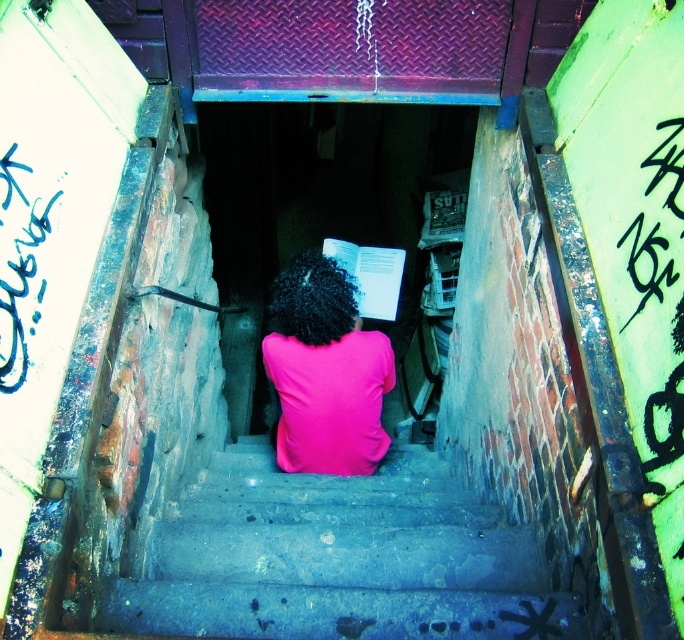
You are standing at the entrance of the alleyway and want to reach the smooth concrete stairs at center. What direction should you move in to get there?

The smooth concrete stairs at center are located at point 0.873 on the x axis and 0.497 on the y axis. Since you are at the entrance, you should move towards the center of the alleyway to reach them.

You are standing at the entrance of the alleyway and want to approach the person sitting on the smooth concrete stairs at center while avoiding stepping on the pink matte shirt at center. Which side should you walk on to reach the stairs safely?

The smooth concrete stairs at center is positioned on the right side of the pink matte shirt at center, so you should walk on the left side of the pink matte shirt at center to reach the stairs safely without stepping on it.

You are a delivery person trying to navigate through the alleyway. The smooth concrete stairs at center are in your path. Considering the pink matte shirt at center is currently occupying part of the stairs, can you still pass through the stairs without stepping on the person?

The smooth concrete stairs at center might be wider than pink matte shirt at center, so there might be enough space to navigate around the person sitting on the stairs without stepping on them. However, since the exact width isn not specified, proceed with caution.